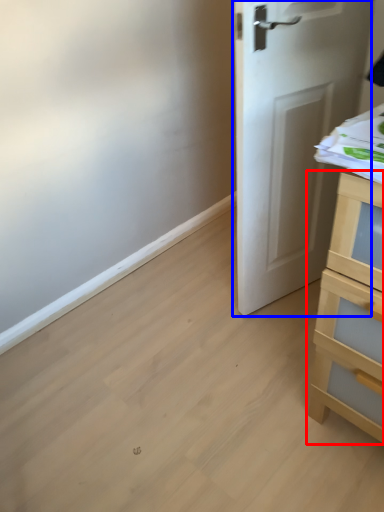
Question: Among these objects, which one is farthest to the camera, chest of drawers (highlighted by a red box) or door (highlighted by a blue box)?

Choices:
 (A) chest of drawers
 (B) door

Answer: (B)